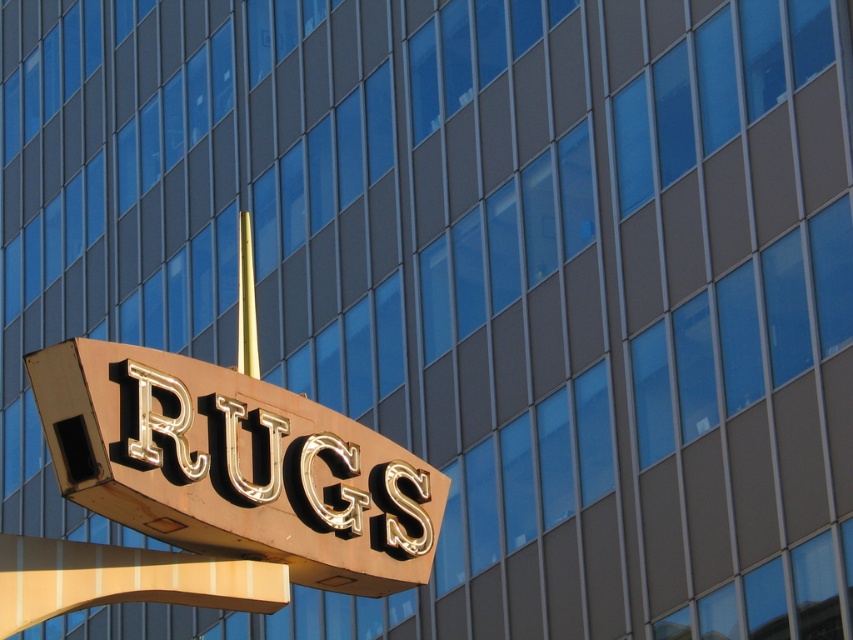
Question: Considering the relative positions of gold metallic sign at center and rustic wood sign at center in the image provided, where is gold metallic sign at center located with respect to rustic wood sign at center?

Choices:
 (A) left
 (B) right

Answer: (B)

Question: Among these objects, which one is nearest to the camera?

Choices:
 (A) gold polished pole at center
 (B) gold metallic sign at center
 (C) rustic wood sign at center

Answer: (B)

Question: Which object is positioned farthest from the rustic wood sign at center?

Choices:
 (A) gold metallic sign at center
 (B) gold polished pole at center

Answer: (B)

Question: Is the position of gold metallic sign at center less distant than that of rustic wood sign at center?

Choices:
 (A) no
 (B) yes

Answer: (B)

Question: Which point is farther to the camera?

Choices:
 (A) (376, 460)
 (B) (236, 282)
 (C) (230, 609)

Answer: (B)

Question: Is rustic wood sign at center thinner than gold polished pole at center?

Choices:
 (A) no
 (B) yes

Answer: (B)